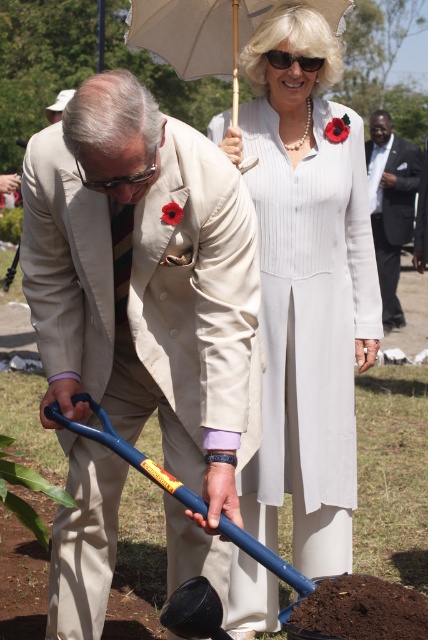
In the scene shown: You are a photographer at the event and need to capture a closeup of the white pleated dress at upper center and the matte black goggles at left. Which object should you zoom in on first to ensure both are in focus?

The white pleated dress at upper center is wider than the matte black goggles at left, so you should zoom in on the white pleated dress at upper center first to ensure both are in focus.

You are a photographer at the event and need to capture a closeup of the white pleated dress at upper center and the sunglasses at upper center in the same frame. Can you fit both items in the shot if your camera has a maximum field of view of 28 inches?

The white pleated dress at upper center and sunglasses at upper center are 28.93 inches apart, which exceeds the camera field of view of 28 inches. Therefore, both items cannot be captured in the same frame.